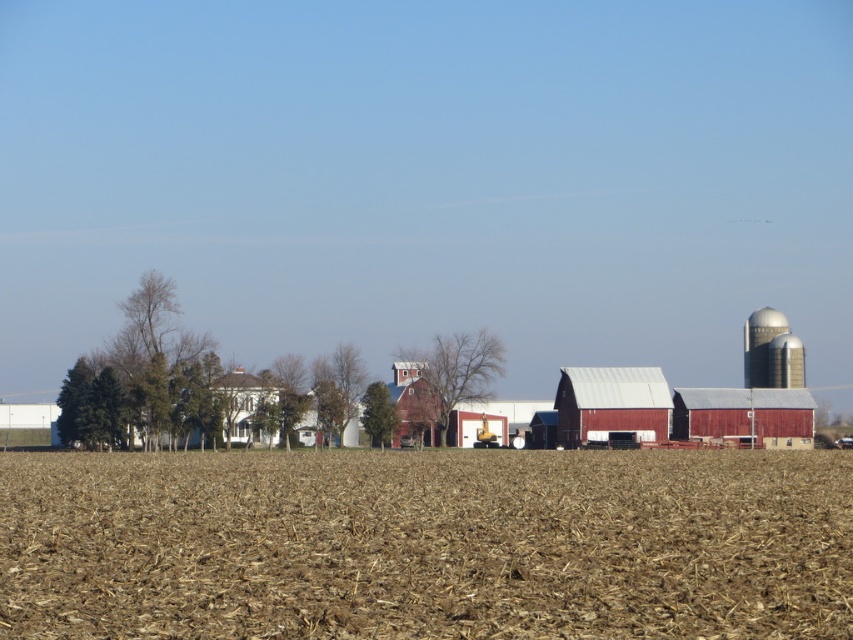
Between metallic red barn at center and red corrugated metal barn at center, which one appears on the right side from the viewer's perspective?

red corrugated metal barn at center

Is point (581, 397) more distant than point (705, 412)?

Yes.

Is point (572, 429) less distant than point (737, 435)?

No, (572, 429) is behind (737, 435).

At what (x,y) coordinates should I click in order to perform the action: click on metallic red barn at center. Please return your answer as a coordinate pair (x, y). Looking at the image, I should click on (611, 404).

Does metallic red barn at center have a larger size compared to white painted wood house at left?

Correct, metallic red barn at center is larger in size than white painted wood house at left.

This screenshot has height=640, width=853. What do you see at coordinates (611, 404) in the screenshot? I see `metallic red barn at center` at bounding box center [611, 404].

You are a GUI agent. You are given a task and a screenshot of the screen. Output one action in this format:
    pyautogui.click(x=<x>, y=<y>)
    Task: Click on the metallic red barn at center
    This screenshot has height=640, width=853.
    Given the screenshot: What is the action you would take?
    pyautogui.click(x=611, y=404)

Describe the element at coordinates (426, 545) in the screenshot. I see `brown dirt field at center` at that location.

Measure the distance between brown dirt field at center and camera.

brown dirt field at center and camera are 10.03 meters apart.

Image resolution: width=853 pixels, height=640 pixels. What do you see at coordinates (426, 545) in the screenshot?
I see `brown dirt field at center` at bounding box center [426, 545].

This screenshot has width=853, height=640. Identify the location of brown dirt field at center. (426, 545).